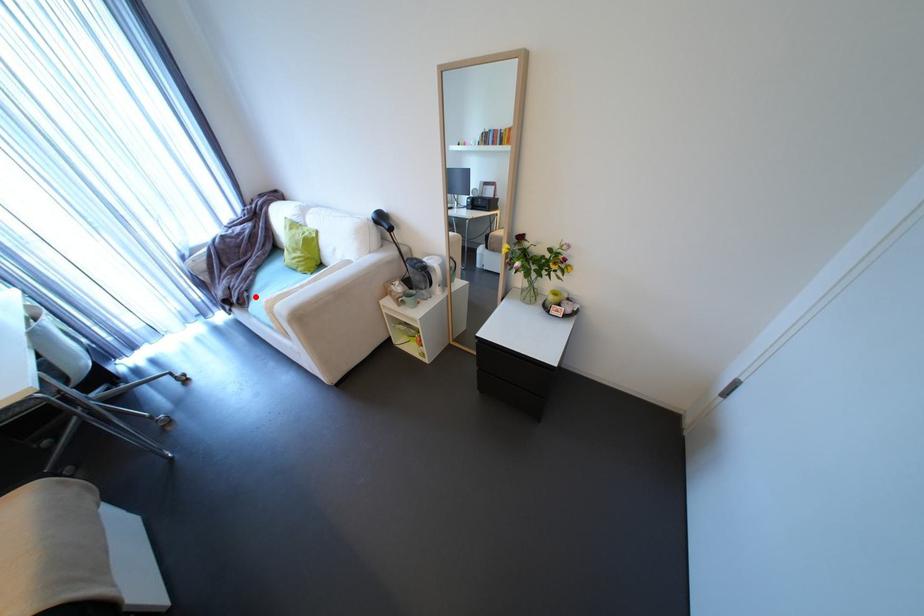
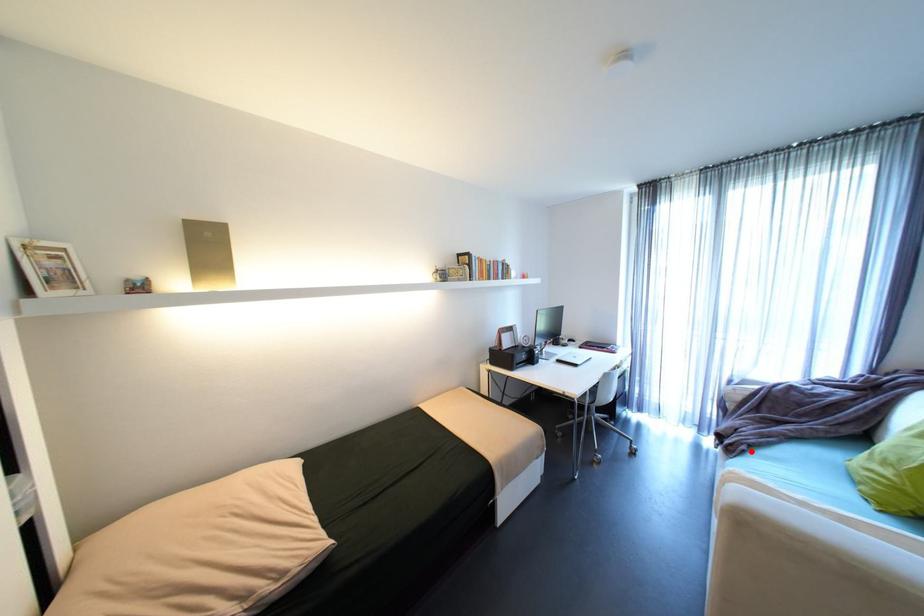
I am providing you with two images of the same scene from different viewpoints. A red point is marked on the first image and another point is marked on the second image. Does the point marked in image1 correspond to the same location as the one in image2?

Yes